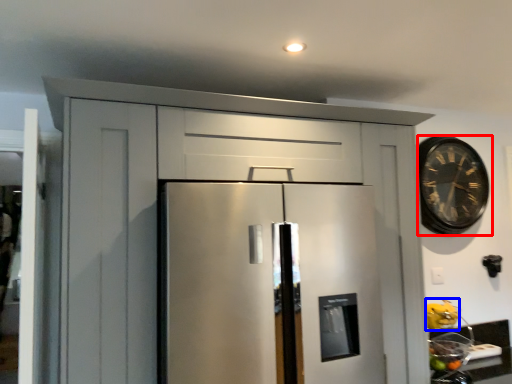
Question: Among these objects, which one is farthest to the camera, clock (highlighted by a red box) or fruit (highlighted by a blue box)?

Choices:
 (A) clock
 (B) fruit

Answer: (A)